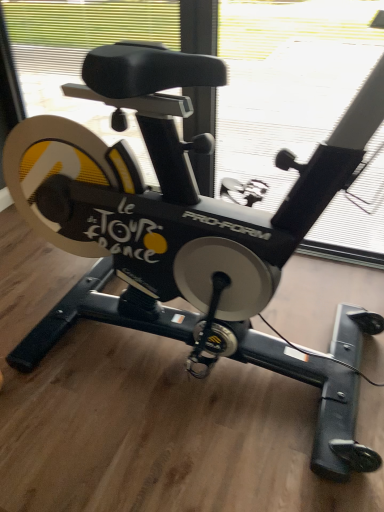
Where is `vacant space underneath transparent plastic window screen at upper center, the first window screen from the front (from a real-world perspective)`? The height and width of the screenshot is (512, 384). vacant space underneath transparent plastic window screen at upper center, the first window screen from the front (from a real-world perspective) is located at coordinates [x=208, y=386].